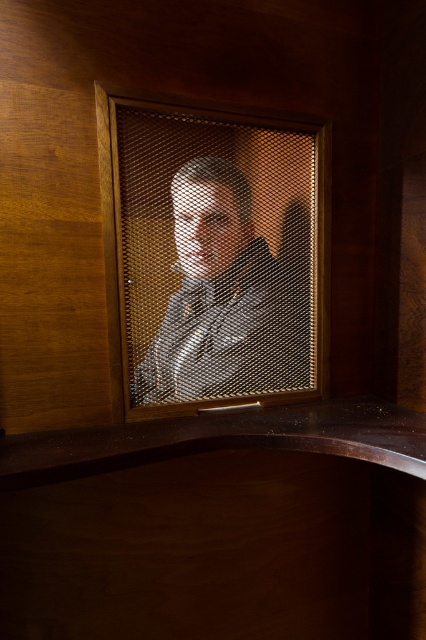
You are an interior designer planning to place a small potted plant in the scene. The potted plant has a diameter of 0.3 meters. The coordinates of the metal mesh at center are given as point [210,256]. Can the potted plant be placed at this point without overlapping the metal mesh?

The point [210,256] indicates the location of the metal mesh at center. Since the potted plant would be placed exactly at this point, it would overlap with the metal mesh. Therefore, the potted plant cannot be placed there.

You are an interior designer assessing the layout of a cozy study. You notice the metal mesh at center and the matte black shirt at center. Based on their positions, which object is closer to the left side of the study?

The metal mesh at center is to the left of the matte black shirt at center, so it is closer to the left side of the study.